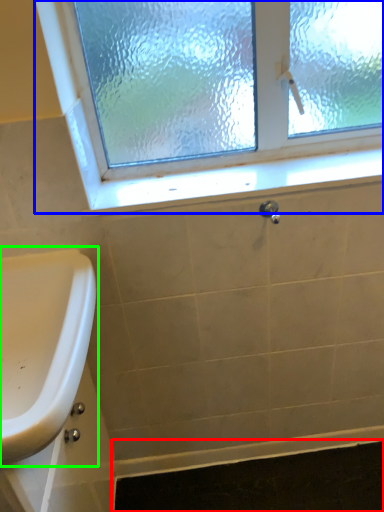
Question: Which object is the farthest from bath mat (highlighted by a red box)? Choose among these: window (highlighted by a blue box) or sink (highlighted by a green box).

Choices:
 (A) window
 (B) sink

Answer: (A)